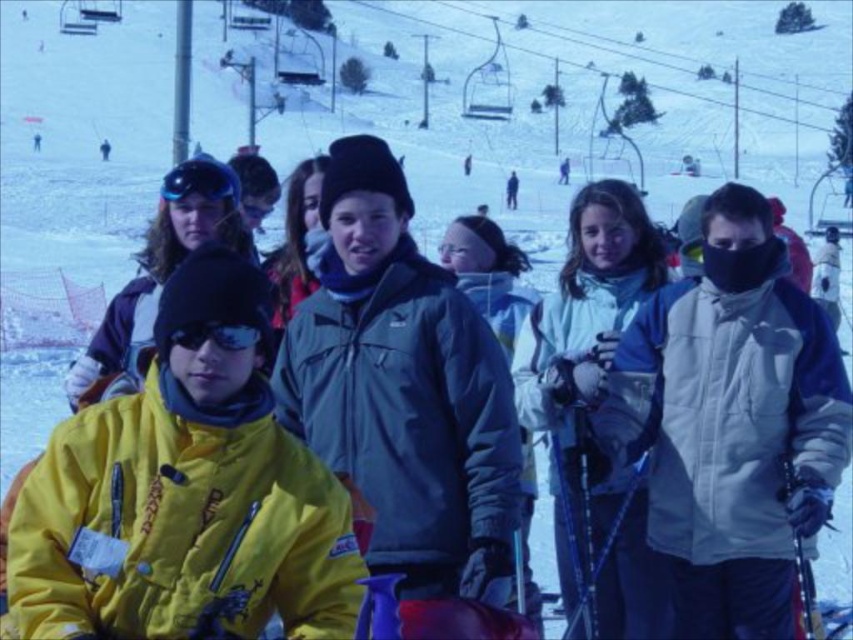
You are a photographer trying to capture a photo of the black reflective goggles at center. However, the blue matte helmet at upper left is blocking your view. Can you move to the right or left to avoid the obstruction?

The blue matte helmet at upper left is located above the black reflective goggles at center, so moving to the right or left might not help since the helmet is directly above the goggles. You might need to move forward or backward to adjust your angle.

You are a photographer trying to capture a group photo of the people at the ski resort. You want to ensure that both the point at point (219, 184) and the point at point (184, 346) are in focus. Which point should you focus on first to ensure both are sharp?

You should focus on point (219, 184) first because it is closer to the viewer than point (184, 346). By focusing on the closer point, the farther point will also be within the depth of field, ensuring both are sharp.